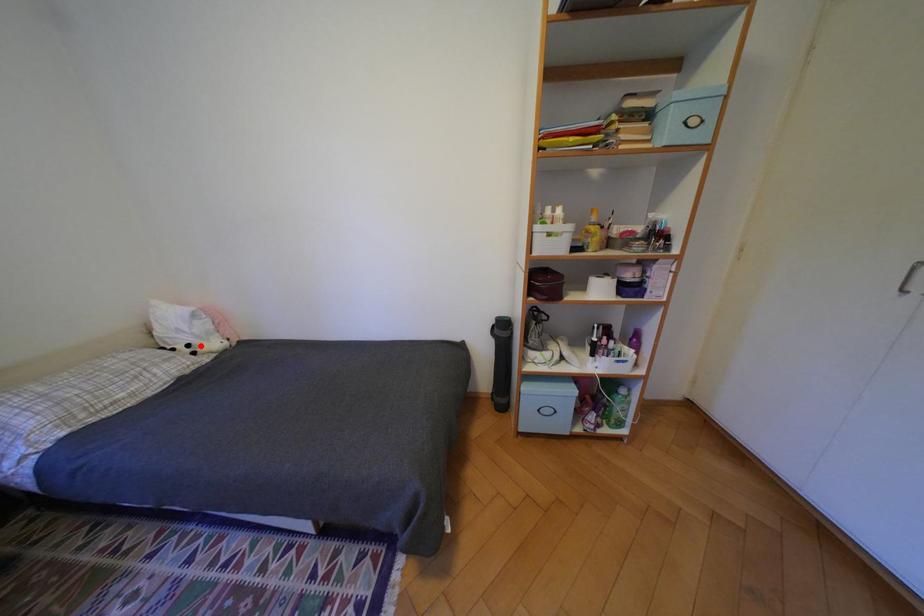
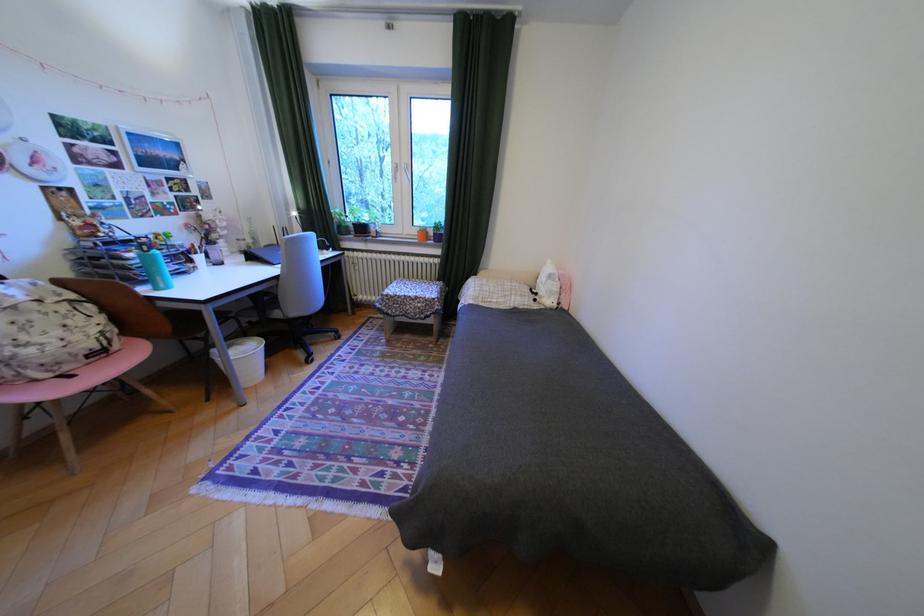
The point at the highlighted location is marked in the first image. Where is the corresponding point in the second image?

(548, 294)